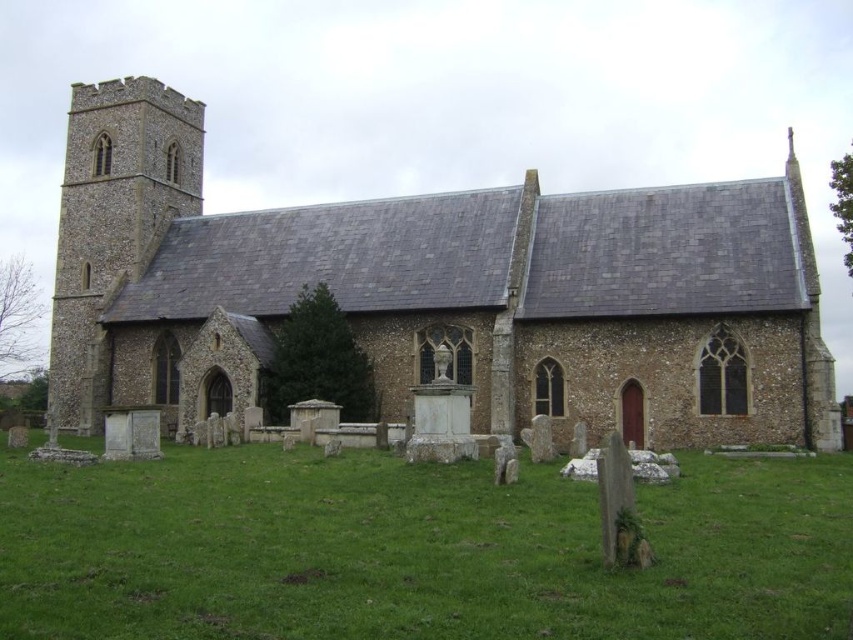
Which is in front, point (416, 301) or point (67, 493)?

Point (67, 493) is more forward.

Is brown stone church at center closer to the viewer compared to green grass at lower center?

No.

Is point (73, 316) positioned before point (442, 609)?

That is False.

Identify the location of brown stone church at center. Image resolution: width=853 pixels, height=640 pixels. (437, 291).

Can you confirm if green grass at lower center is positioned to the left of brown stone tower at left?

Incorrect, green grass at lower center is not on the left side of brown stone tower at left.

Can you confirm if green grass at lower center is wider than brown stone tower at left?

Yes, green grass at lower center is wider than brown stone tower at left.

Measure the distance between green grass at lower center and camera.

They are 20.04 meters apart.

Where is `green grass at lower center`? green grass at lower center is located at coordinates (415, 550).

Is brown stone church at center to the right of brown stone tower at left from the viewer's perspective?

Yes, brown stone church at center is to the right of brown stone tower at left.

Between point (790, 392) and point (99, 96), which one is positioned in front?

Point (790, 392)

Who is more distant from viewer, (685, 340) or (136, 88)?

Point (136, 88)

Where is `brown stone church at center`? Image resolution: width=853 pixels, height=640 pixels. brown stone church at center is located at coordinates (437, 291).